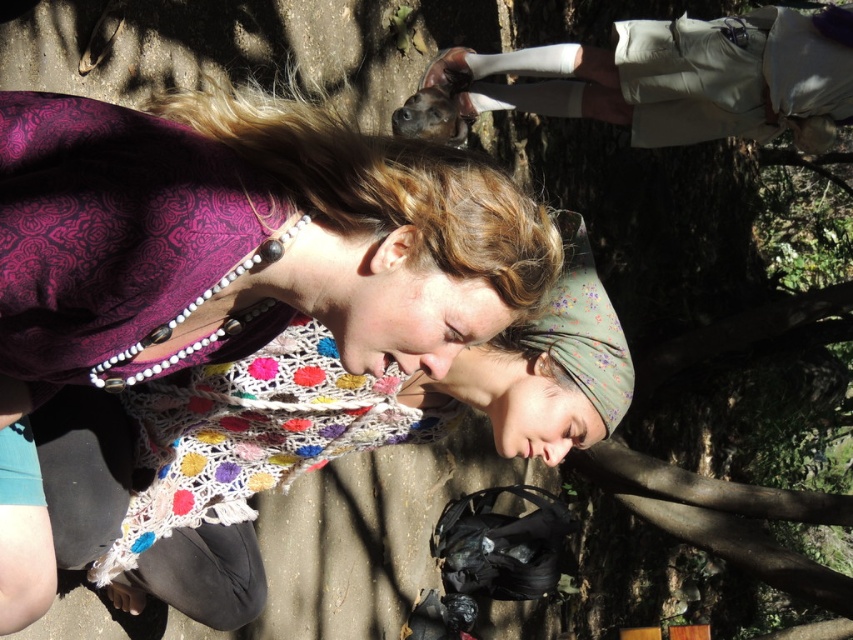
Question: Among these objects, which one is nearest to the camera?

Choices:
 (A) light beige shorts at upper right
 (B) multicolored crochet scarf at center

Answer: (B)

Question: Which point appears closest to the camera in this image?

Choices:
 (A) (701, 20)
 (B) (492, 372)

Answer: (B)

Question: Among these objects, which one is farthest from the camera?

Choices:
 (A) light beige shorts at upper right
 (B) multicolored crochet scarf at center

Answer: (A)

Question: Is multicolored crochet scarf at center smaller than light beige shorts at upper right?

Choices:
 (A) yes
 (B) no

Answer: (B)

Question: Considering the relative positions of multicolored crochet scarf at center and light beige shorts at upper right in the image provided, where is multicolored crochet scarf at center located with respect to light beige shorts at upper right?

Choices:
 (A) right
 (B) left

Answer: (B)

Question: Can you confirm if multicolored crochet scarf at center is positioned to the left of light beige shorts at upper right?

Choices:
 (A) no
 (B) yes

Answer: (B)